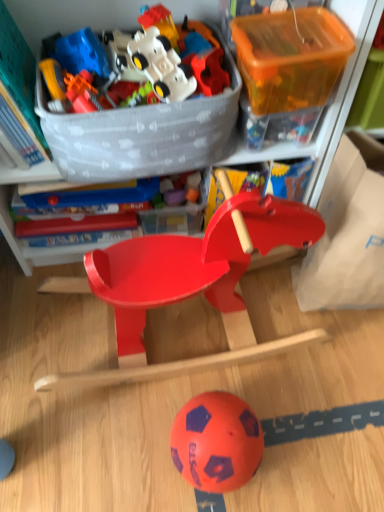
Identify the location of free point below matte plastic rocking horse at center, the 6th toy viewed from the top (from a real-world perspective). (171, 328).